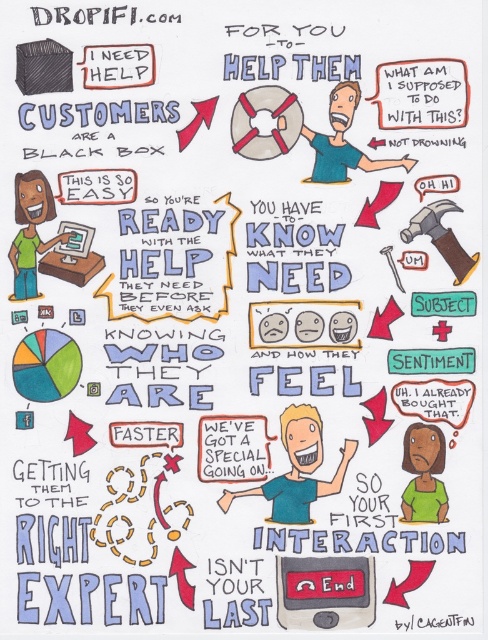
Based on the scene, which object is wider, the light blue shirt at center or the matte gray life preserver at center?

The light blue shirt at center is wider than the matte gray life preserver at center according to the description.

You are designing a customer service infographic and need to ensure the life preserver and blue shirt are close enough to imply interaction. Given that the minimum required distance for visual connection is 1.5 inches, can the matte gray life preserver at center and blue shirt at center be placed as shown?

The matte gray life preserver at center is 1.43 inches from the blue shirt at center, which is within the required 1.5 inches distance for visual connection. Therefore, they can be placed as shown.

What is the object located at the coordinates point (264, 122) in the image?

The object at point (264, 122) is the matte gray life preserver at center.